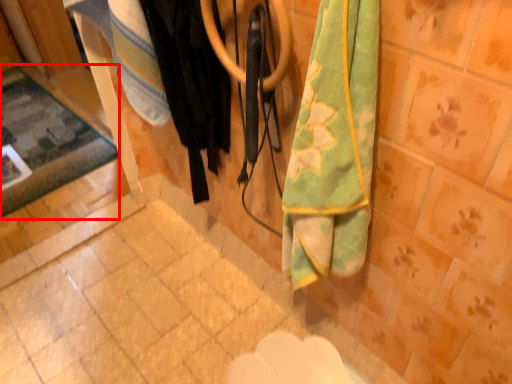
Question: From the image's perspective, what is the correct spatial relationship of mat (annotated by the red box) in relation to clothing?

Choices:
 (A) above
 (B) below

Answer: (A)